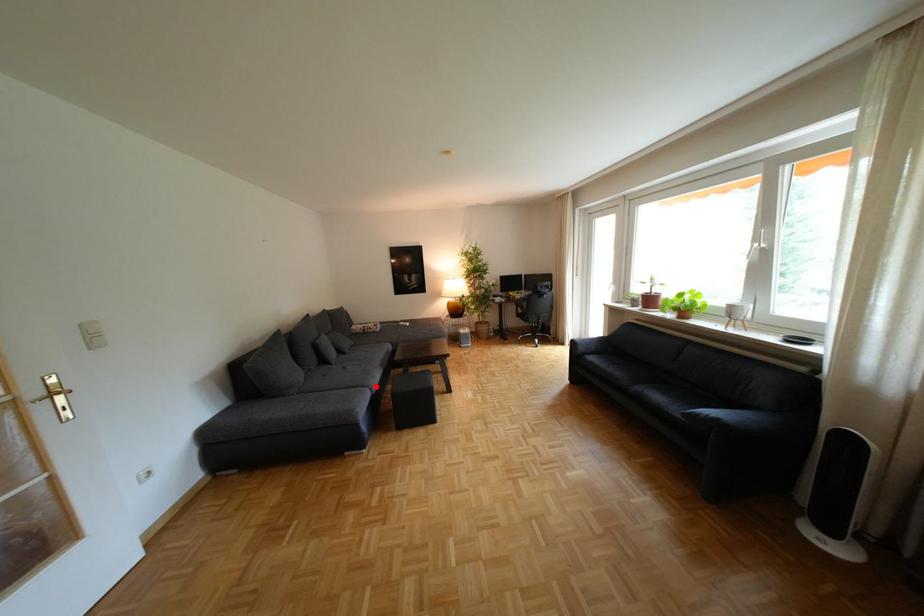
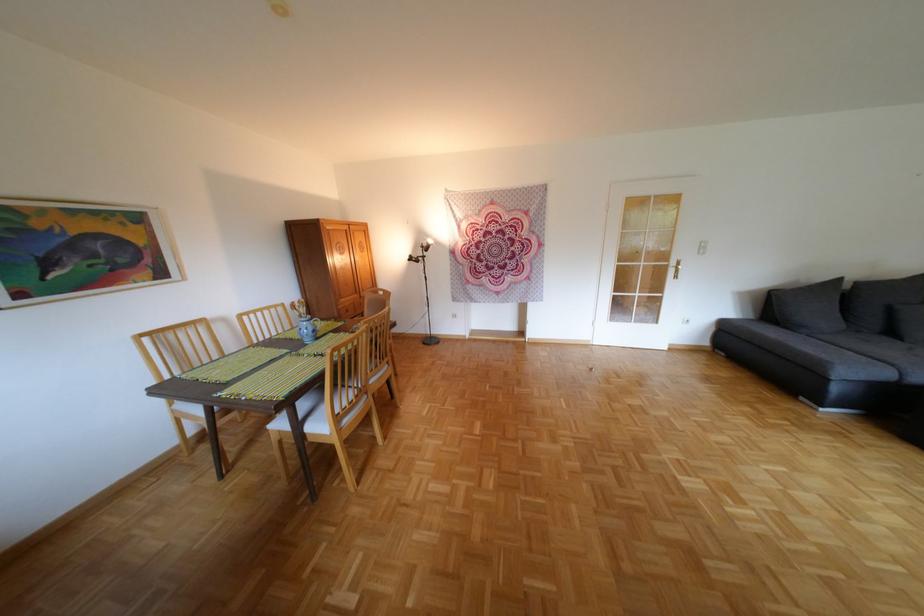
Question: A red point is marked in image1. In image2, is the corresponding 3D point closer to the camera or farther? Reply with the corresponding letter.

Choices:
 (A) The corresponding 3D point is closer.
 (B) The corresponding 3D point is farther.

Answer: (B)